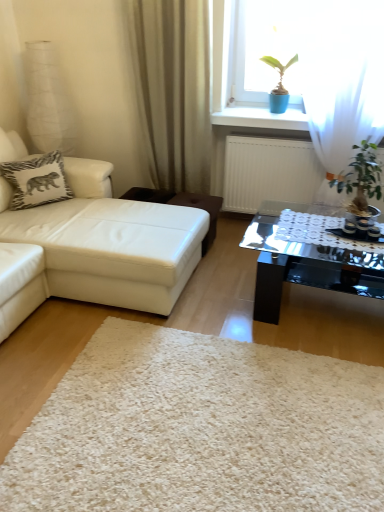
Question: Is white leather studio couch at left positioned beyond the bounds of white shaggy rug at center?

Choices:
 (A) yes
 (B) no

Answer: (A)

Question: From the image's perspective, is white leather studio couch at left over white shaggy rug at center?

Choices:
 (A) no
 (B) yes

Answer: (B)

Question: Does white leather studio couch at left turn towards white shaggy rug at center?

Choices:
 (A) yes
 (B) no

Answer: (B)

Question: Is white leather studio couch at left not near white shaggy rug at center?

Choices:
 (A) yes
 (B) no

Answer: (B)

Question: Is white leather studio couch at left next to white shaggy rug at center?

Choices:
 (A) no
 (B) yes

Answer: (A)

Question: Is white leather studio couch at left wider than white shaggy rug at center?

Choices:
 (A) no
 (B) yes

Answer: (B)

Question: Is brown leather stool at center surrounded by white zebra-patterned pillow at upper left?

Choices:
 (A) yes
 (B) no

Answer: (B)

Question: Could you tell me if white zebra-patterned pillow at upper left is facing brown leather stool at center?

Choices:
 (A) no
 (B) yes

Answer: (A)

Question: From the image's perspective, is white zebra-patterned pillow at upper left on brown leather stool at center?

Choices:
 (A) no
 (B) yes

Answer: (B)

Question: Does white zebra-patterned pillow at upper left have a smaller size compared to brown leather stool at center?

Choices:
 (A) no
 (B) yes

Answer: (B)

Question: From a real-world perspective, does white zebra-patterned pillow at upper left sit lower than brown leather stool at center?

Choices:
 (A) no
 (B) yes

Answer: (A)

Question: Is white zebra-patterned pillow at upper left to the left of brown leather stool at center from the viewer's perspective?

Choices:
 (A) yes
 (B) no

Answer: (A)

Question: Is white zebra-patterned pillow at upper left positioned beyond the bounds of green leafy plant at right?

Choices:
 (A) no
 (B) yes

Answer: (B)